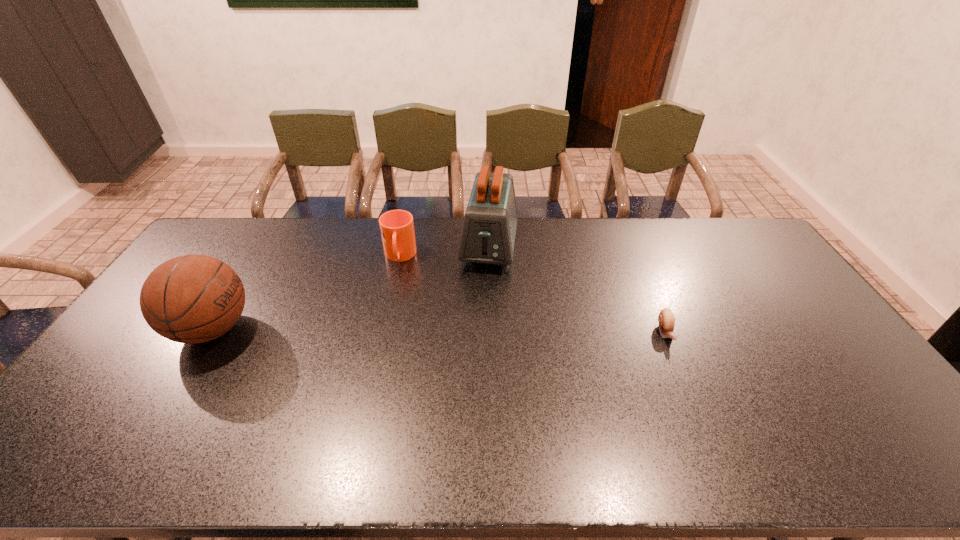
Where is `basketball`? This screenshot has height=540, width=960. basketball is located at coordinates (190, 299).

The image size is (960, 540). I want to click on the third shortest object, so tap(190, 299).

The width and height of the screenshot is (960, 540). Find the location of `the rightmost object`. the rightmost object is located at coordinates (666, 318).

Find the location of a particular element. escargot is located at coordinates (666, 318).

Identify the location of the third tallest object. This screenshot has width=960, height=540. (397, 230).

Where is `the third object from right to left`? The width and height of the screenshot is (960, 540). the third object from right to left is located at coordinates (397, 230).

Find the location of a particular element. This screenshot has height=540, width=960. the third object from left to right is located at coordinates (488, 234).

Find the location of a particular element. the tallest object is located at coordinates (488, 234).

I want to click on vacant space located on the side with brand label of the leftmost object, so click(x=304, y=329).

Locate an element on the screen. The height and width of the screenshot is (540, 960). vacant space located 0.120m on the front-facing side of the escargot is located at coordinates (686, 382).